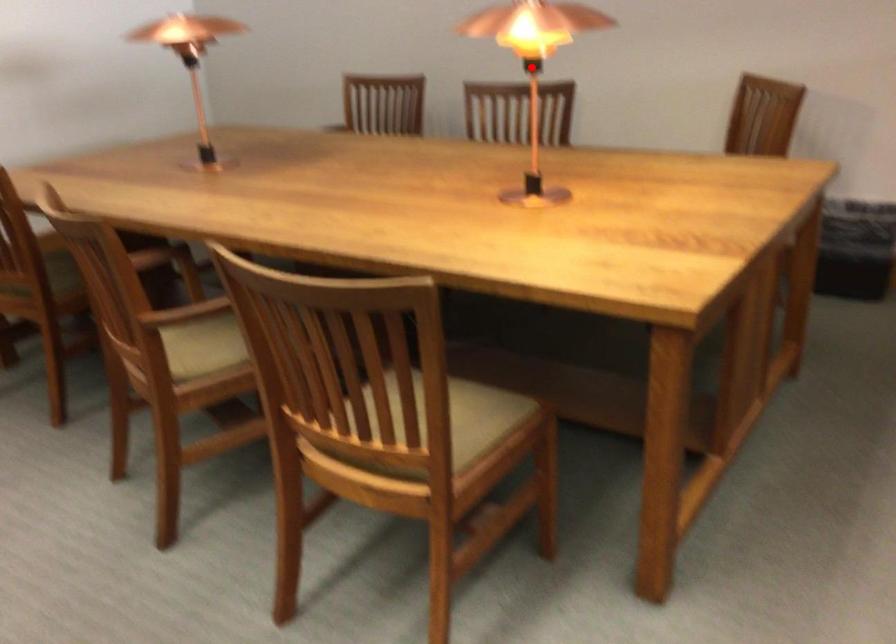
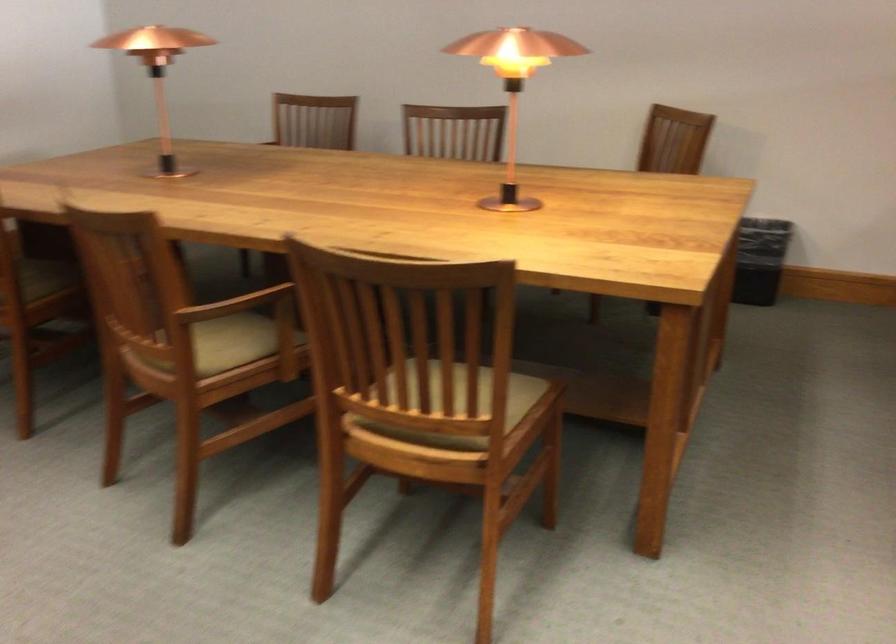
Question: A red point is marked in image1. In image2, is the corresponding 3D point closer to the camera or farther? Reply with the corresponding letter.

Choices:
 (A) The corresponding 3D point is closer.
 (B) The corresponding 3D point is farther.

Answer: (B)